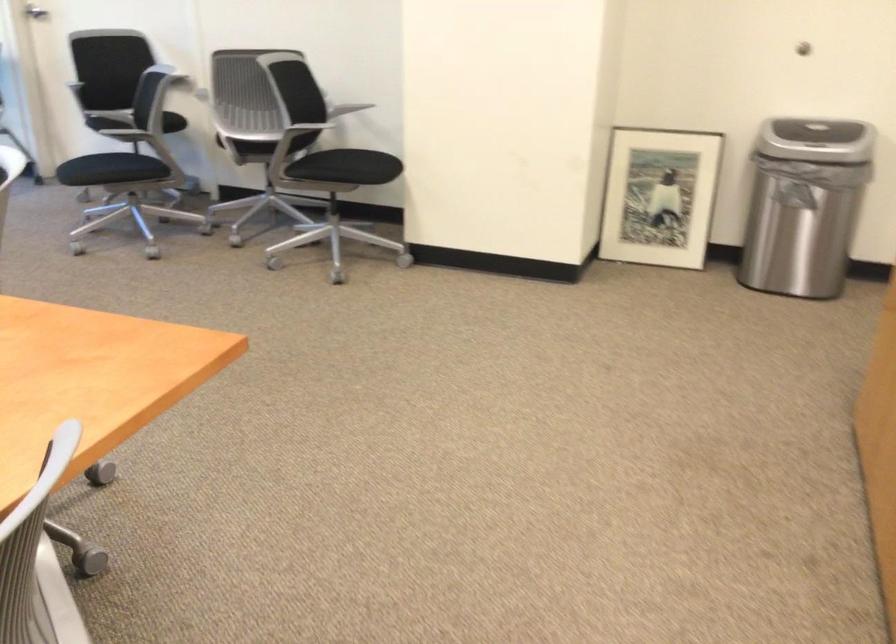
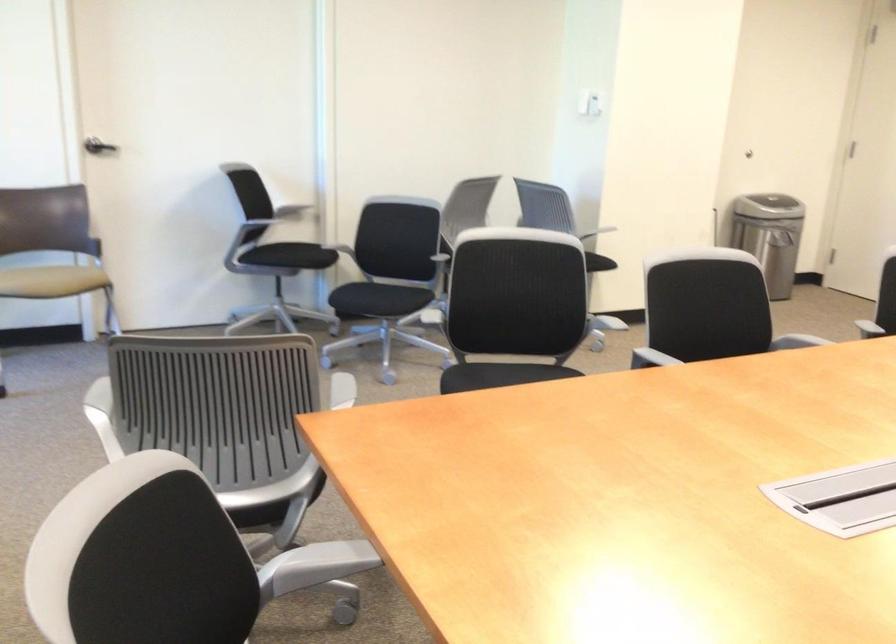
Question: I am providing you with two images of the same scene from different viewpoints. Which of the following objects are not visible in image2?

Choices:
 (A) beige chair sitting surface
 (B) black chair sitting surface
 (C) folding drying rack
 (D) chair sitting surface

Answer: (D)